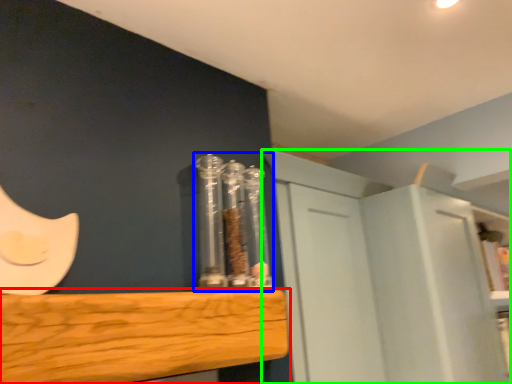
Question: Considering the real-world distances, which object is closest to furniture (highlighted by a red box)? glass jar (highlighted by a blue box) or cabinetry (highlighted by a green box).

Choices:
 (A) glass jar
 (B) cabinetry

Answer: (A)